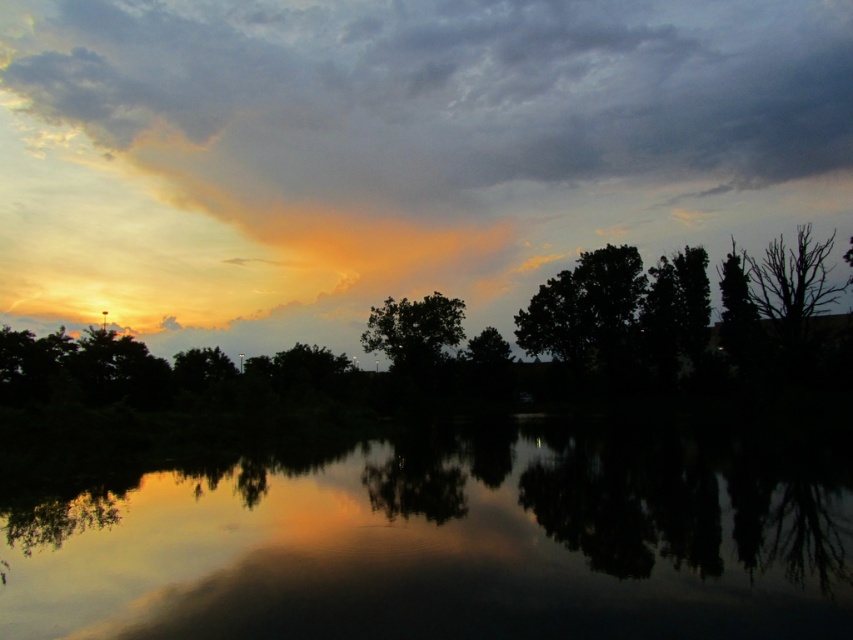
Image resolution: width=853 pixels, height=640 pixels. What do you see at coordinates (395, 152) in the screenshot? I see `orange translucent cloud at upper center` at bounding box center [395, 152].

Who is more distant from viewer, (675, 93) or (376, 570)?

The point (675, 93) is behind.

Between point (347, 216) and point (461, 570), which one is positioned behind?

Positioned behind is point (347, 216).

The height and width of the screenshot is (640, 853). I want to click on orange translucent cloud at upper center, so click(x=395, y=152).

Which is above, green leafy tree at center or green matte tree at center?

green leafy tree at center is higher up.

Is green leafy tree at center to the left of green matte tree at center from the viewer's perspective?

Yes, green leafy tree at center is to the left of green matte tree at center.

Who is more forward, (x=375, y=312) or (x=498, y=348)?

Positioned in front is point (x=375, y=312).

Locate an element on the screen. This screenshot has width=853, height=640. green leafy tree at center is located at coordinates (415, 330).

Is orange translucent cloud at upper center above green matte tree at center?

Indeed, orange translucent cloud at upper center is positioned over green matte tree at center.

Does point (271, 10) lie in front of point (469, 348)?

No.

Locate an element on the screen. The height and width of the screenshot is (640, 853). orange translucent cloud at upper center is located at coordinates (395, 152).